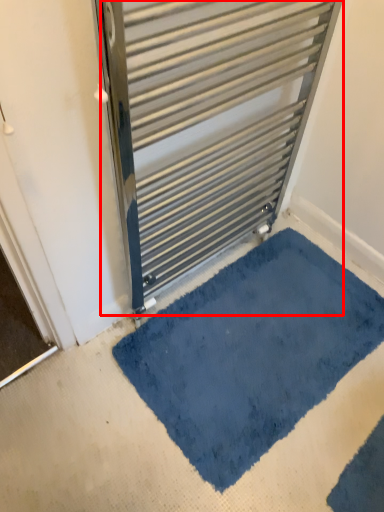
Question: In this image, where is radiator (annotated by the red box) located relative to bath mat?

Choices:
 (A) right
 (B) left

Answer: (B)